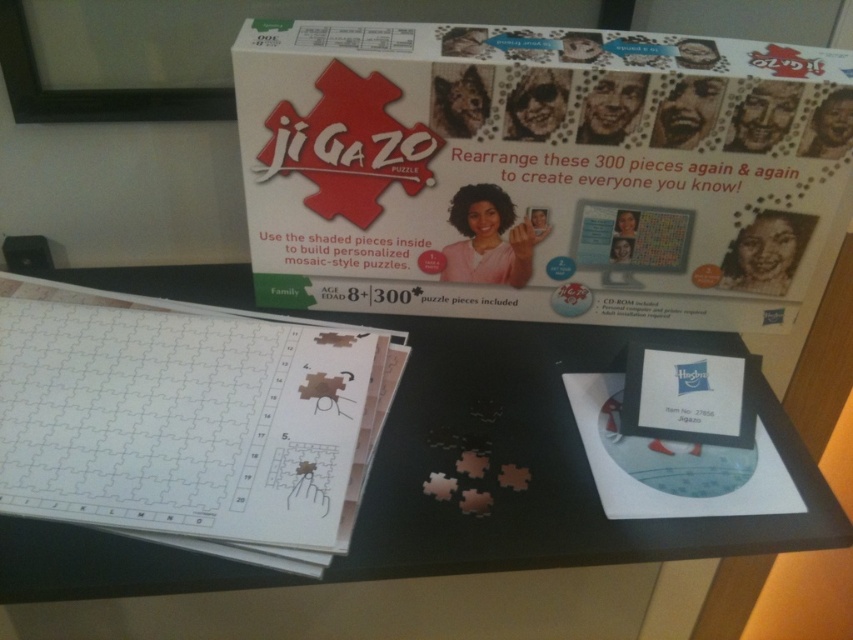
What is the position of the point (538, 170) in relation to the white cardboard poster at upper center?

The point (538, 170) is located on the white cardboard poster at upper center.